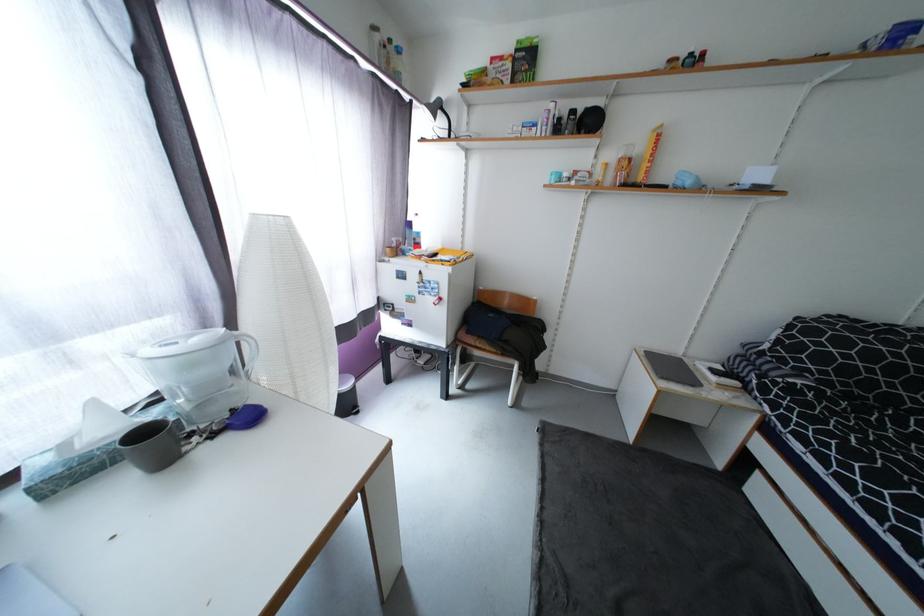
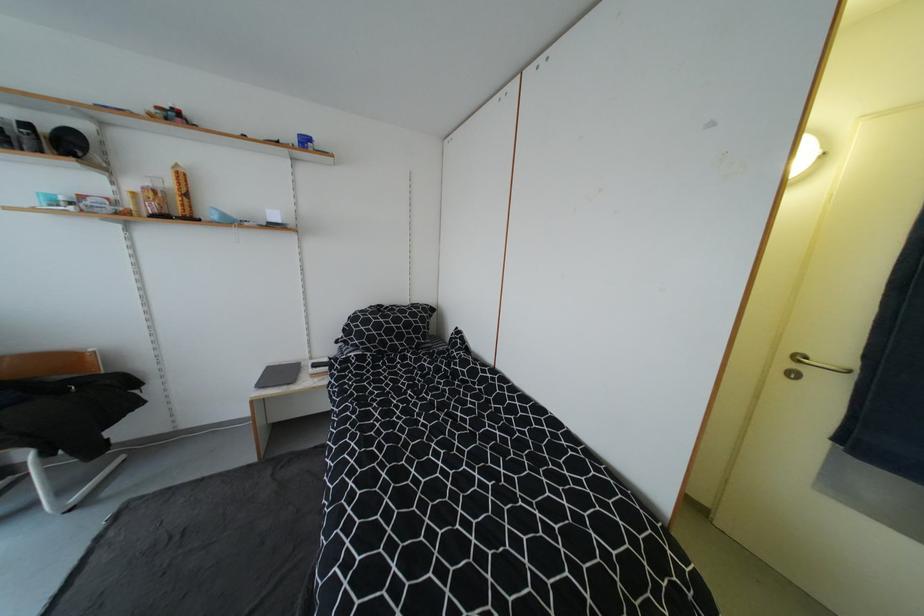
Locate, in the second image, the point that corresponds to (x=673, y=368) in the first image.

(286, 376)